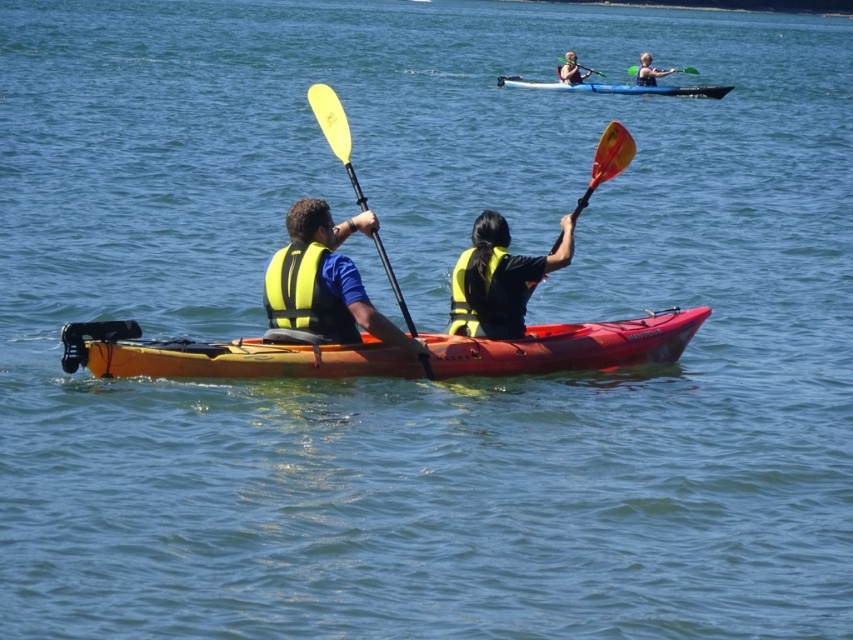
You are standing on the dock and want to retrieve the yellow fabric life jacket at left. There is an orange plastic canoe at center blocking your path. Can you reach the life jacket without moving the canoe?

The orange plastic canoe at center is closer to the viewer than the yellow fabric life jacket at left, so the canoe is between you and the life jacket. Therefore, you cannot reach the life jacket without moving the canoe.

You are standing on the shore observing the two kayakers. You notice two points marked on the image at coordinates point (521, 80) and point (596, 72). Which point is closer to you?

Point (521, 80) is in front of point (596, 72), so it is closer to you.